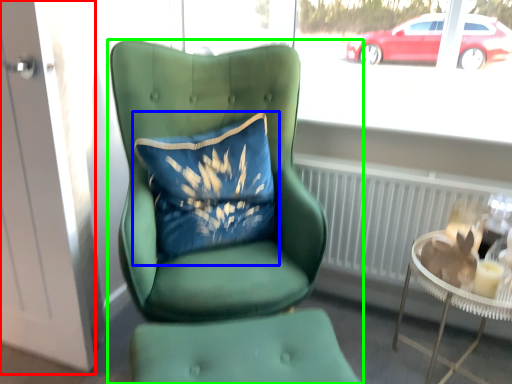
Question: Which is farther away from screen door (highlighted by a red box)? pillow (highlighted by a blue box) or chair (highlighted by a green box)?

Choices:
 (A) pillow
 (B) chair

Answer: (B)